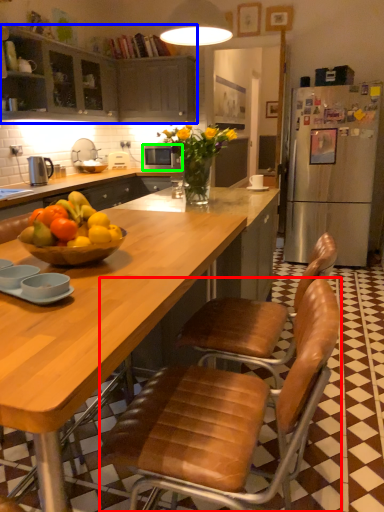
Question: Based on their relative distances, which object is nearer to chair (highlighted by a red box)? Choose from cabinetry (highlighted by a blue box) and microwave oven (highlighted by a green box).

Choices:
 (A) cabinetry
 (B) microwave oven

Answer: (A)